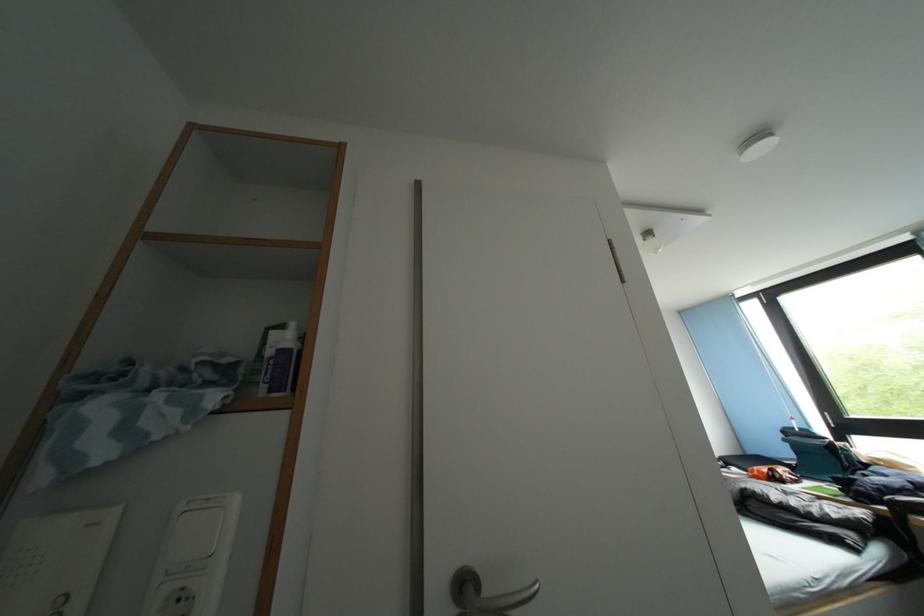
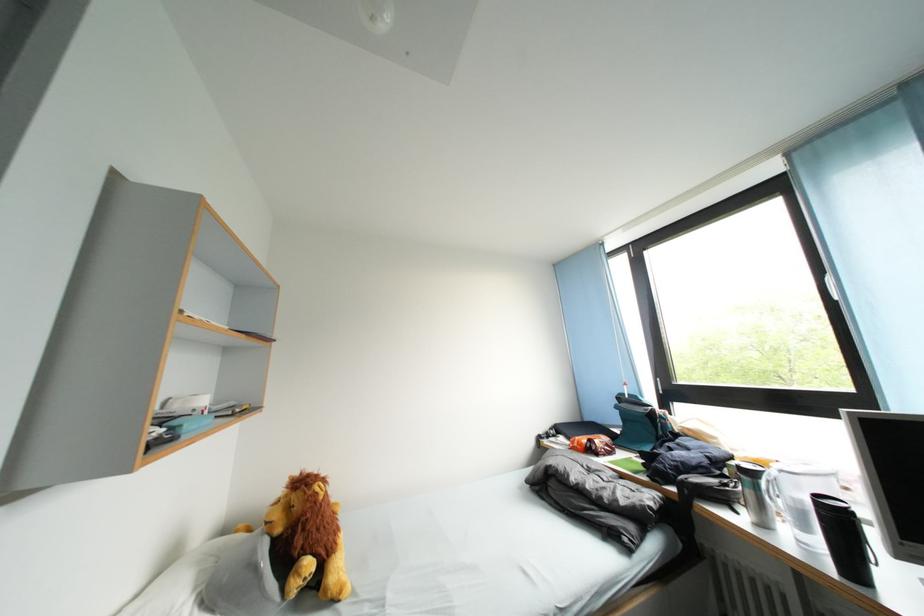
The point at (x=784, y=484) is marked in the first image. Where is the corresponding point in the second image?

(600, 455)